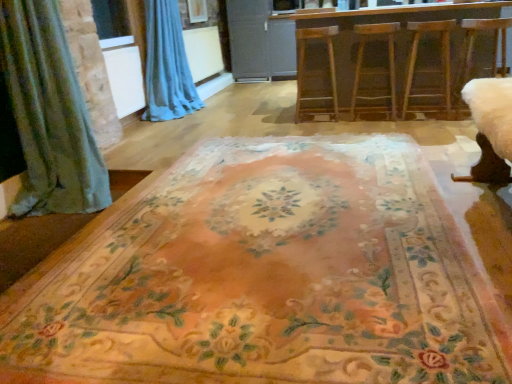
Question: Should I look upward or downward to see matte gray screen door at center?

Choices:
 (A) down
 (B) up

Answer: (B)

Question: Is floral carpet at center outside wooden stool at center, the 2th armchair when ordered from left to right?

Choices:
 (A) no
 (B) yes

Answer: (B)

Question: From a real-world perspective, is floral carpet at center positioned over wooden stool at center, positioned as the 2th armchair in right-to-left order, based on gravity?

Choices:
 (A) no
 (B) yes

Answer: (A)

Question: Does floral carpet at center appear on the left side of wooden stool at center, positioned as the 2th armchair in right-to-left order?

Choices:
 (A) yes
 (B) no

Answer: (A)

Question: Does floral carpet at center turn towards wooden stool at center, positioned as the 2th armchair in right-to-left order?

Choices:
 (A) no
 (B) yes

Answer: (A)

Question: Does floral carpet at center lie behind wooden stool at center, the 2th armchair when ordered from left to right?

Choices:
 (A) yes
 (B) no

Answer: (B)

Question: From the image's perspective, is floral carpet at center on wooden stool at center, the 2th armchair when ordered from left to right?

Choices:
 (A) yes
 (B) no

Answer: (B)

Question: Does matte gray screen door at center appear on the left side of wooden barstools at center?

Choices:
 (A) yes
 (B) no

Answer: (A)

Question: Is matte gray screen door at center thinner than wooden barstools at center?

Choices:
 (A) no
 (B) yes

Answer: (B)

Question: Can you confirm if matte gray screen door at center is smaller than wooden barstools at center?

Choices:
 (A) no
 (B) yes

Answer: (B)

Question: Is matte gray screen door at center at the right side of wooden barstools at center?

Choices:
 (A) yes
 (B) no

Answer: (B)

Question: Is matte gray screen door at center not close to wooden barstools at center?

Choices:
 (A) no
 (B) yes

Answer: (B)

Question: From a real-world perspective, is matte gray screen door at center on wooden barstools at center?

Choices:
 (A) yes
 (B) no

Answer: (A)

Question: From the image's perspective, would you say white fabric swivel chair at right is shown under wooden barstools at center?

Choices:
 (A) no
 (B) yes

Answer: (B)